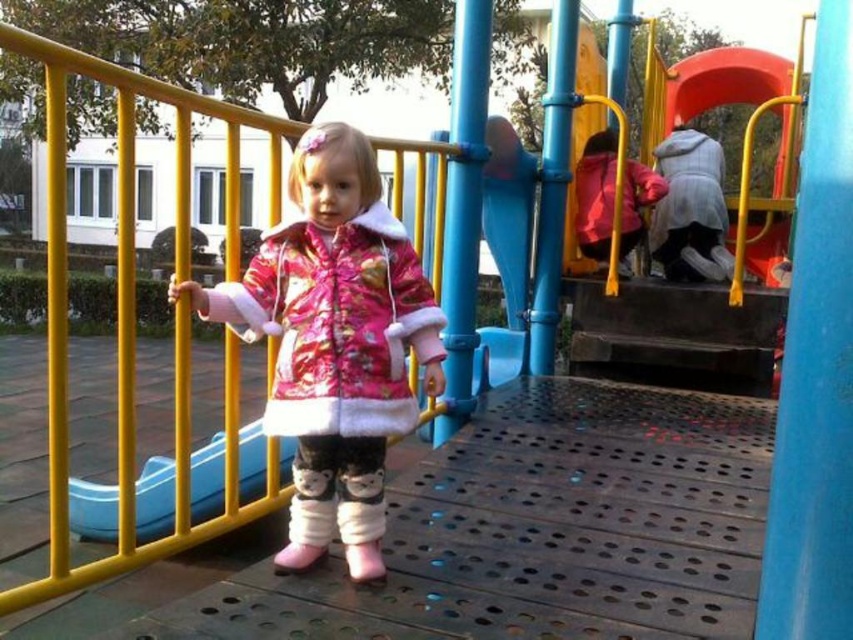
Which is behind, point (161, 492) or point (585, 208)?

Positioned behind is point (585, 208).

Is point (107, 532) positioned before point (630, 195)?

Yes, it is.

Measure the distance between point (x=79, y=500) and camera.

9.15 feet

In order to click on blue plastic slide at center in this screenshot , I will do `click(155, 499)`.

Who is positioned more to the left, fluffy pink jacket at center or blue plastic slide at center?

blue plastic slide at center is more to the left.

Between point (265, 332) and point (115, 515), which one is positioned in front?

Point (265, 332) is in front.

At what (x,y) coordinates should I click in order to perform the action: click on fluffy pink jacket at center. Please return your answer as a coordinate pair (x, y). Looking at the image, I should click on (335, 323).

Who is shorter, fluffy pink coat at center or fluffy pink jacket at center?

fluffy pink jacket at center is shorter.

Who is more distant from viewer, (405, 298) or (326, 397)?

Positioned behind is point (405, 298).

This screenshot has height=640, width=853. Identify the location of fluffy pink coat at center. (334, 342).

Identify the location of fluffy pink coat at center. This screenshot has height=640, width=853. pos(334,342).